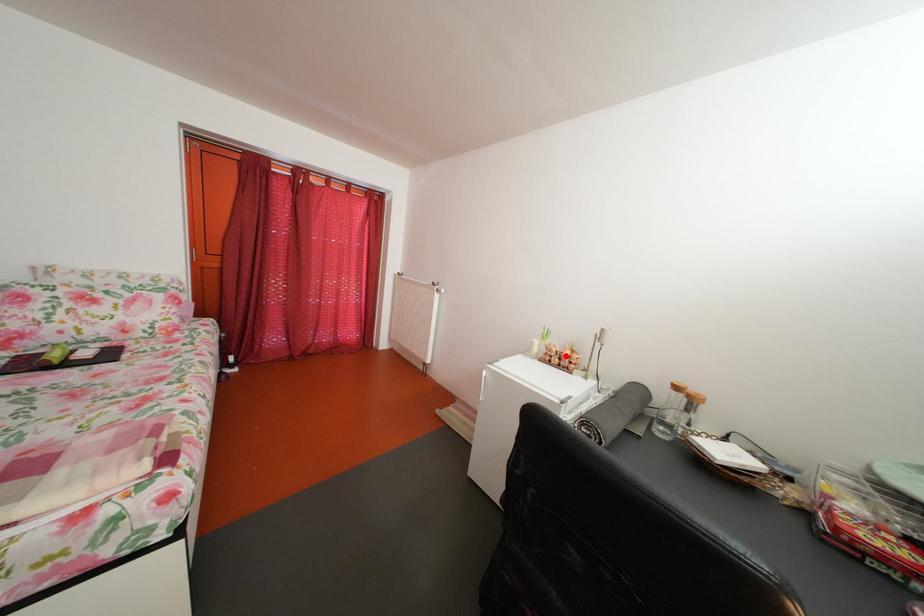
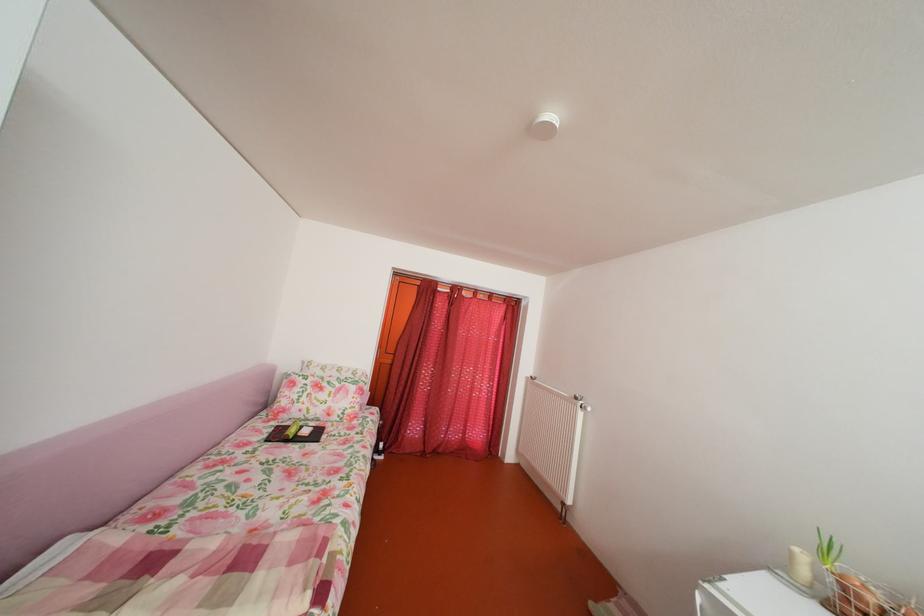
The point at the highlighted location is marked in the first image. Where is the corresponding point in the second image?

(882, 607)